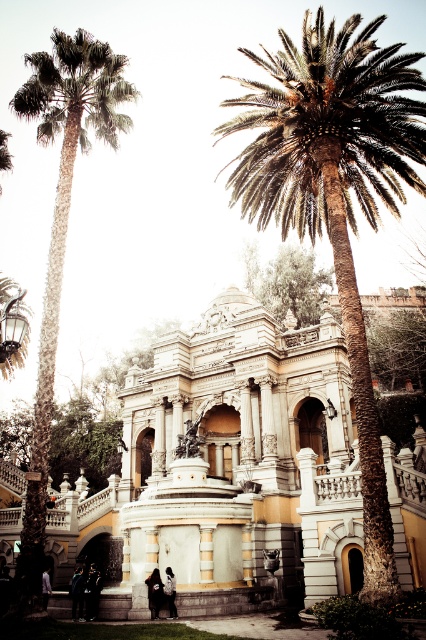
In the scene shown: Who is more forward, (121, 577) or (161, 593)?

Point (161, 593) is in front.

Consider the image. Does yellow stone palace at center lie behind dark brown leather jacket at lower center?

That is False.

Between point (290, 388) and point (161, 602), which one is positioned in front?

Positioned in front is point (161, 602).

Identify the location of yellow stone palace at center. The width and height of the screenshot is (426, 640). (227, 465).

Does yellow stone palace at center appear over green leafy tree at upper center?

No, yellow stone palace at center is not above green leafy tree at upper center.

Between yellow stone palace at center and green leafy tree at upper center, which one has more height?

Standing taller between the two is yellow stone palace at center.

Which is in front, point (327, 321) or point (307, 288)?

Point (327, 321) is more forward.

The image size is (426, 640). What are the coordinates of `yellow stone palace at center` in the screenshot? It's located at (227, 465).

Does yellow stone palace at center have a lesser width compared to green leafy palm at left?

In fact, yellow stone palace at center might be wider than green leafy palm at left.

Who is more distant from viewer, (268, 428) or (115, 100)?

The point (268, 428) is more distant.

Image resolution: width=426 pixels, height=640 pixels. Describe the element at coordinates (227, 465) in the screenshot. I see `yellow stone palace at center` at that location.

This screenshot has height=640, width=426. I want to click on yellow stone palace at center, so click(x=227, y=465).